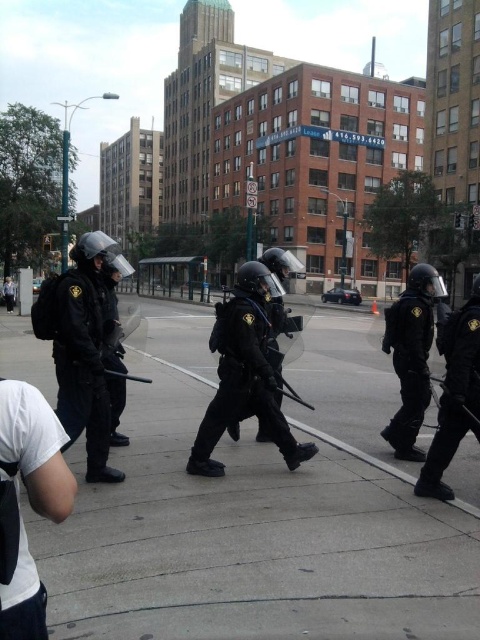
You are a delivery person trying to navigate through the street. You see the concrete at center and the black matte helmet at right. Which object is lower in height?

The concrete at center is not as tall as the black matte helmet at right, so the concrete at center is lower in height.